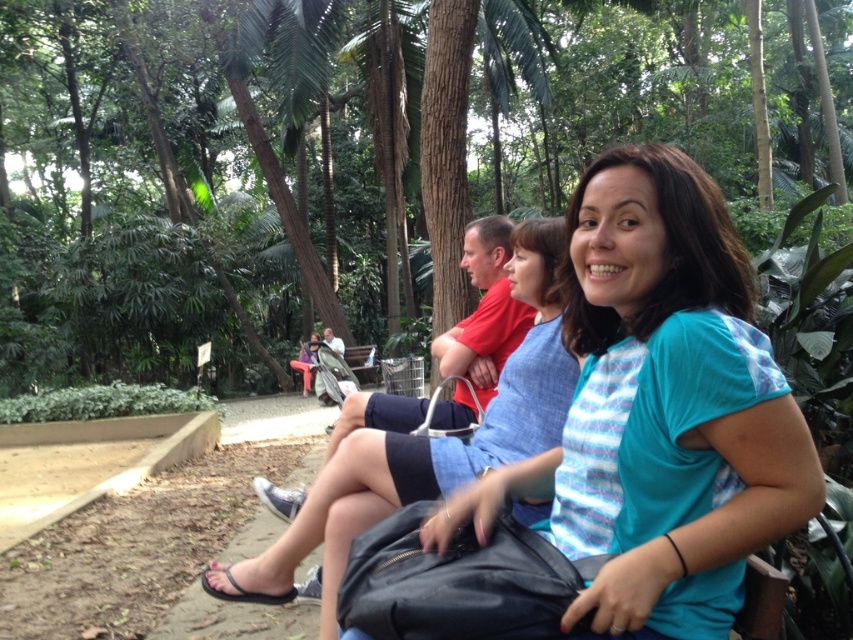
Who is more forward, (80, 150) or (672, 433)?

Point (672, 433) is in front.

Is green leafy tree at center closer to the viewer compared to matte blue shirt at center?

No, it is not.

You are a GUI agent. You are given a task and a screenshot of the screen. Output one action in this format:
    pyautogui.click(x=<x>, y=<y>)
    Task: Click on the green leafy tree at center
    This screenshot has height=640, width=853.
    Given the screenshot: What is the action you would take?
    pyautogui.click(x=309, y=161)